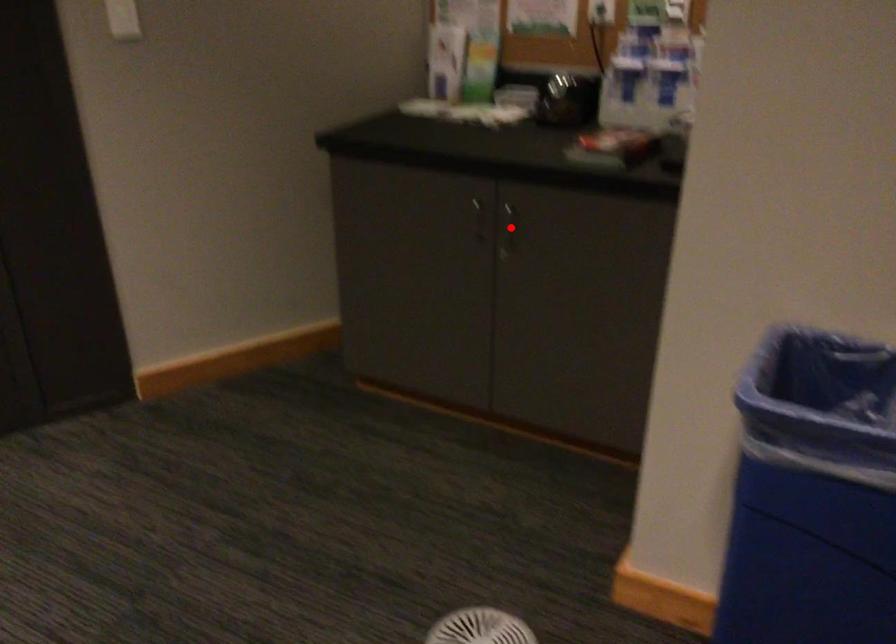
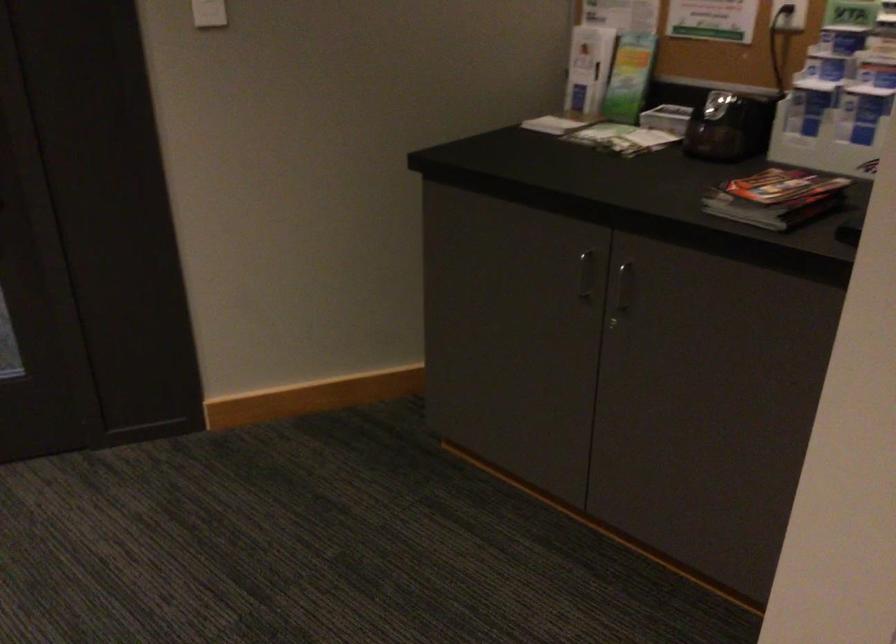
In the second image, find the point that corresponds to the highlighted location in the first image.

(622, 292)